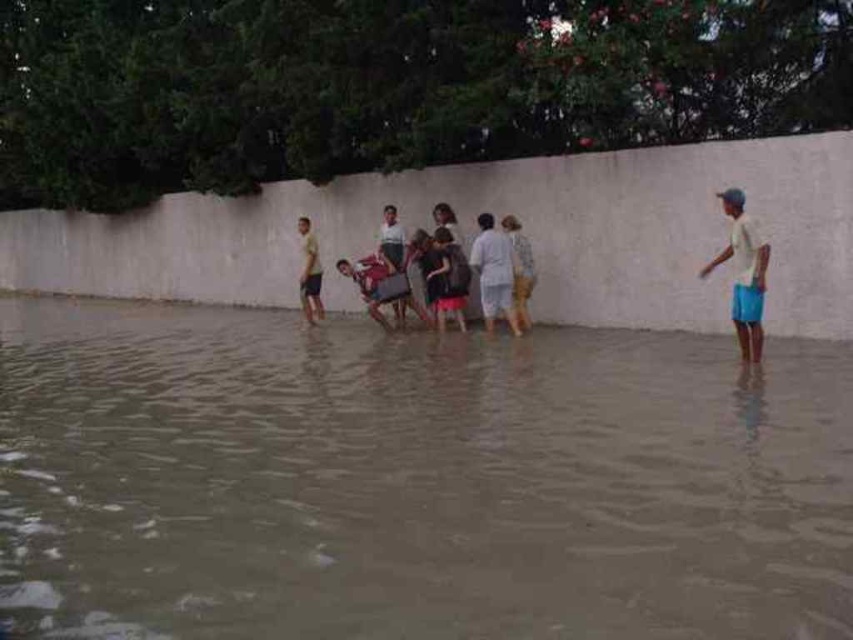
Who is shorter, brown murky water at center or white cotton shirt at right?

brown murky water at center is shorter.

Is point (281, 518) less distant than point (755, 353)?

Yes, point (281, 518) is in front of point (755, 353).

I want to click on brown murky water at center, so click(413, 481).

Who is lower down, dark gray fabric dress at center or light brown fabric dress at center?

dark gray fabric dress at center is lower down.

Is dark gray fabric dress at center bigger than light brown fabric dress at center?

Indeed, dark gray fabric dress at center has a larger size compared to light brown fabric dress at center.

Who is more distant from viewer, (444, 305) or (519, 301)?

Point (444, 305)

Locate an element on the screen. This screenshot has width=853, height=640. dark gray fabric dress at center is located at coordinates (450, 278).

Is brown murky water at center to the left of light brown fabric dress at center from the viewer's perspective?

Correct, you'll find brown murky water at center to the left of light brown fabric dress at center.

Can you confirm if brown murky water at center is thinner than light brown fabric dress at center?

No, brown murky water at center is not thinner than light brown fabric dress at center.

Who is more distant from viewer, (165, 592) or (514, 300)?

The point (514, 300) is more distant.

Identify the location of brown murky water at center. This screenshot has width=853, height=640. (413, 481).